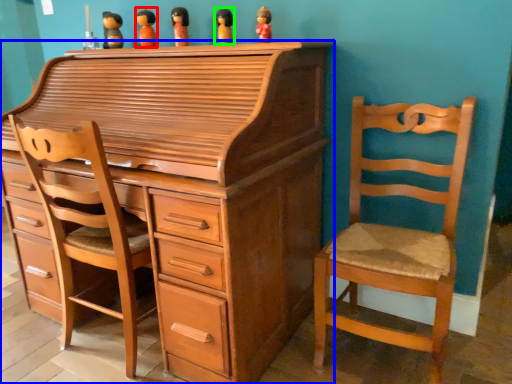
Question: Estimate the real-world distances between objects in this image. Which object is closer to toy (highlighted by a red box), chest of drawers (highlighted by a blue box) or toy (highlighted by a green box)?

Choices:
 (A) chest of drawers
 (B) toy

Answer: (B)